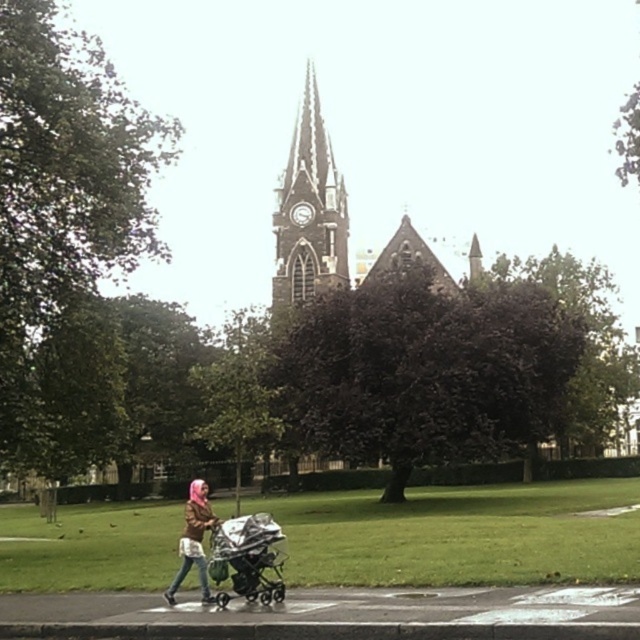
Question: Is the position of metallic silver stroller at center less distant than that of pink fabric baby stroller at lower center?

Choices:
 (A) yes
 (B) no

Answer: (A)

Question: Is metallic silver stroller at center above pink fabric baby stroller at lower center?

Choices:
 (A) no
 (B) yes

Answer: (A)

Question: Which object is positioned closest to the metallic silver stroller at center?

Choices:
 (A) dark brown stone clock tower at center
 (B) pink fabric baby stroller at lower center

Answer: (B)

Question: Is dark brown stone clock tower at center to the right of metallic silver stroller at center from the viewer's perspective?

Choices:
 (A) no
 (B) yes

Answer: (B)

Question: Which object is farther from the camera taking this photo?

Choices:
 (A) pink fabric baby stroller at lower center
 (B) dark brown stone clock tower at center

Answer: (B)

Question: Which point is closer to the camera?

Choices:
 (A) (212, 522)
 (B) (266, 564)
 (C) (273, 276)

Answer: (B)